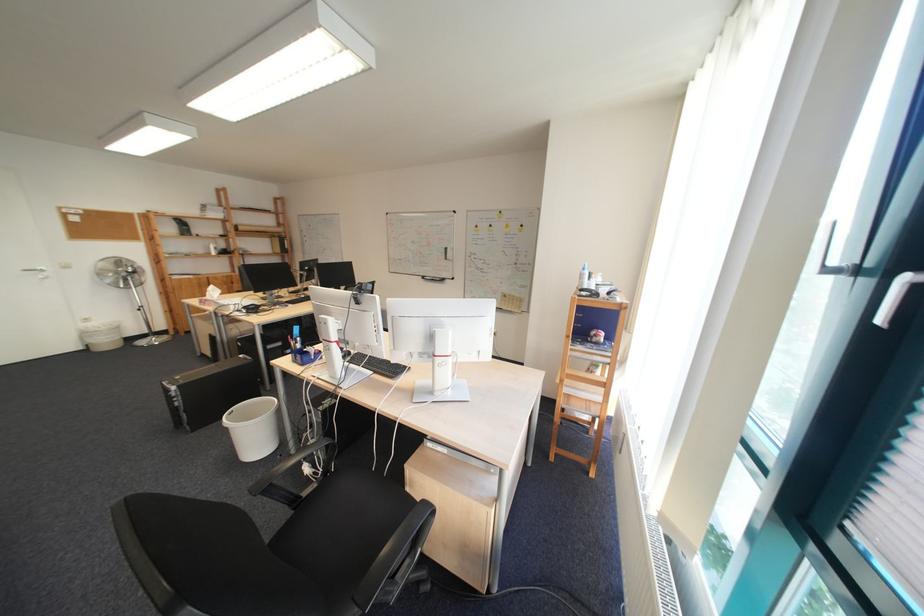
Image resolution: width=924 pixels, height=616 pixels. What do you see at coordinates (832, 257) in the screenshot? I see `the silver door handle` at bounding box center [832, 257].